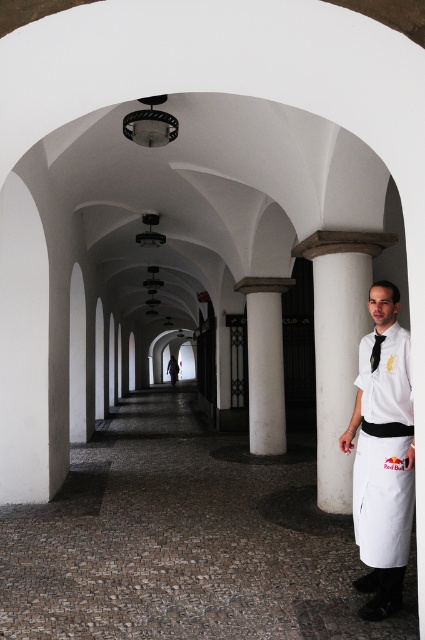
Based on the photo, does white smooth column at center lie behind black silk tie at right?

Yes, it is.

Is point (257, 333) farther from camera compared to point (373, 360)?

Yes, point (257, 333) is behind point (373, 360).

Is point (257, 276) farther from camera compared to point (379, 333)?

Yes, point (257, 276) is farther from viewer.

At what (x,y) coordinates should I click in order to perform the action: click on white smooth column at center. Please return your answer as a coordinate pair (x, y). This screenshot has height=640, width=425. Looking at the image, I should click on (265, 362).

Consider the image. Is white smooth column at right wider than black silk tie at right?

Yes.

Who is higher up, white smooth column at right or black silk tie at right?

black silk tie at right

Does point (351, 248) come farther from viewer compared to point (379, 353)?

Yes, point (351, 248) is behind point (379, 353).

Where is `white smooth column at right`? The image size is (425, 640). white smooth column at right is located at coordinates (337, 344).

Does white matte uniform at right appear on the left side of white smooth column at right?

Yes, white matte uniform at right is to the left of white smooth column at right.

Does point (391, 292) come closer to viewer compared to point (340, 384)?

Yes, point (391, 292) is closer to viewer.

Find the location of a particular element. The image size is (425, 640). white matte uniform at right is located at coordinates (382, 456).

Identify the location of white matte uniform at right. This screenshot has width=425, height=640. (382, 456).